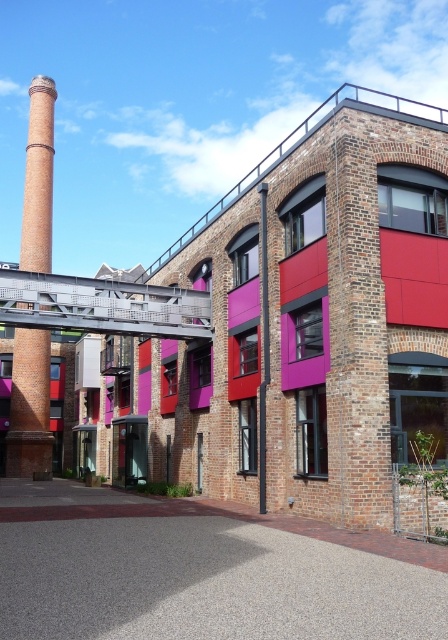
You are standing in front of the brick building at center and looking at the brick at center. Which one is higher from the ground?

The brick building at center is located above the brick at center, so it is higher from the ground.

You are an architect examining the modern building. You notice two objects labeled as brick building at center and brick at center. Which one is positioned more to the left?

The brick building at center is more to the left than the brick at center.

You are an architect examining the modern building. You need to determine which object is wider between the brick building at center and the brick chimney at left. Which one is wider?

The brick building at center is wider than the brick chimney at left according to the description provided.